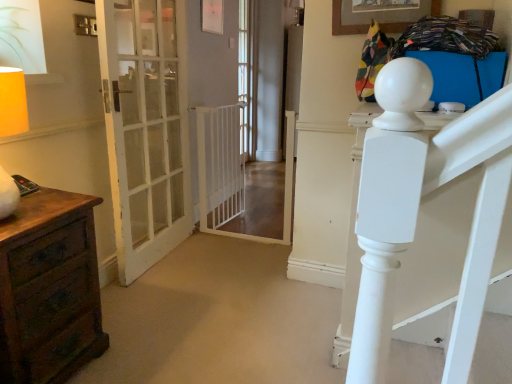
The width and height of the screenshot is (512, 384). What do you see at coordinates (344, 25) in the screenshot? I see `wooden picture frame at upper center` at bounding box center [344, 25].

In order to face white glass door at left, should I rotate leftwards or rightwards?

Turn left by 13.321 degrees to look at white glass door at left.

Find the location of a particular element. Image resolution: width=512 pixels, height=384 pixels. white glass door at left is located at coordinates (145, 127).

Image resolution: width=512 pixels, height=384 pixels. In order to click on wooden picture frame at upper center in this screenshot , I will do `click(344, 25)`.

Between brown wood chest of drawers at left and clear glass door at center, which one has larger size?

With larger size is brown wood chest of drawers at left.

From a real-world perspective, is brown wood chest of drawers at left physically located above or below clear glass door at center?

Clearly, from a real-world perspective, brown wood chest of drawers at left is below clear glass door at center.

Between point (78, 210) and point (256, 129), which one is positioned behind?

The point (256, 129) is more distant.

Would you consider brown wood chest of drawers at left to be distant from clear glass door at center?

Absolutely, brown wood chest of drawers at left is distant from clear glass door at center.

Between white glass door at left and white plastic gate at center, which one has more height?

Standing taller between the two is white glass door at left.

Which object is positioned more to the right, white glass door at left or white plastic gate at center?

white plastic gate at center is more to the right.

Based on the photo, is white glass door at left positioned with its back to white plastic gate at center?

No.

From a real-world perspective, is white glass door at left physically located above or below white plastic gate at center?

In terms of real-world spatial position, white glass door at left is above white plastic gate at center.

Does white glass door at left have a lesser height compared to wooden picture frame at upper center?

No.

At what (x,y) coordinates should I click in order to perform the action: click on door that is behind the wooden picture frame at upper center. Please return your answer as a coordinate pair (x, y). This screenshot has height=384, width=512. Looking at the image, I should click on (145, 127).

Is white glass door at left inside or outside of wooden picture frame at upper center?

white glass door at left is outside wooden picture frame at upper center.

Considering the positions of objects white glass door at left and wooden picture frame at upper center in the image provided, who is more to the left, white glass door at left or wooden picture frame at upper center?

From the viewer's perspective, white glass door at left appears more on the left side.

From a real-world perspective, is white plastic gate at center positioned above or below brown wood chest of drawers at left?

In terms of real-world spatial position, white plastic gate at center is above brown wood chest of drawers at left.

Would you consider white plastic gate at center to be distant from brown wood chest of drawers at left?

That's right, there is a large distance between white plastic gate at center and brown wood chest of drawers at left.

Does white plastic gate at center turn towards brown wood chest of drawers at left?

No, white plastic gate at center is not facing towards brown wood chest of drawers at left.

Is clear glass door at center positioned with its back to wooden picture frame at upper center?

That's not correct — clear glass door at center is not looking away from wooden picture frame at upper center.

Between point (248, 40) and point (439, 11), which one is positioned behind?

The point (248, 40) is farther from the camera.

I want to click on picture frame that appears in front of the clear glass door at center, so click(344, 25).

Does white plastic gate at center have a smaller size compared to wooden picture frame at upper center?

No.

Are white plastic gate at center and wooden picture frame at upper center located far from each other?

Absolutely, white plastic gate at center is distant from wooden picture frame at upper center.

Does white plastic gate at center turn towards wooden picture frame at upper center?

Yes, white plastic gate at center is aimed at wooden picture frame at upper center.

From a real-world perspective, is white plastic gate at center above or below wooden picture frame at upper center?

In terms of real-world spatial position, white plastic gate at center is below wooden picture frame at upper center.

Consider the image. From the image's perspective, between brown wood chest of drawers at left and white plastic gate at center, who is located below?

brown wood chest of drawers at left, from the image's perspective.

Is brown wood chest of drawers at left far from white plastic gate at center?

Indeed, brown wood chest of drawers at left is not near white plastic gate at center.

Which object is wider, brown wood chest of drawers at left or white plastic gate at center?

brown wood chest of drawers at left.

From a real-world perspective, which is physically below, brown wood chest of drawers at left or white plastic gate at center?

brown wood chest of drawers at left is physically lower.

Locate an element on the screen. The width and height of the screenshot is (512, 384). chest of drawers below the clear glass door at center (from the image's perspective) is located at coordinates (49, 288).

Identify the location of door on the left side of white plastic gate at center. (145, 127).

Based on their spatial positions, is brown wood chest of drawers at left or clear glass door at center further from white glass door at left?

The object further to white glass door at left is clear glass door at center.

Looking at the image, which one is located closer to clear glass door at center, brown wood chest of drawers at left or white glass door at left?

Among the two, white glass door at left is located nearer to clear glass door at center.

From the image, which object appears to be farther from white plastic gate at center, brown wood chest of drawers at left or clear glass door at center?

brown wood chest of drawers at left is positioned further to the anchor white plastic gate at center.

Looking at the image, which one is located further to brown wood chest of drawers at left, wooden picture frame at upper center or clear glass door at center?

clear glass door at center is positioned further to the anchor brown wood chest of drawers at left.

Based on their spatial positions, is white plastic gate at center or wooden picture frame at upper center further from white glass door at left?

Based on the image, wooden picture frame at upper center appears to be further to white glass door at left.

Based on their spatial positions, is wooden picture frame at upper center or white plastic gate at center further from brown wood chest of drawers at left?

white plastic gate at center is further to brown wood chest of drawers at left.

Looking at the image, which one is located further to brown wood chest of drawers at left, white glass door at left or white plastic gate at center?

Based on the image, white plastic gate at center appears to be further to brown wood chest of drawers at left.

Considering their positions, is clear glass door at center positioned closer to wooden picture frame at upper center than white glass door at left?

The object closer to wooden picture frame at upper center is white glass door at left.

You are a GUI agent. You are given a task and a screenshot of the screen. Output one action in this format:
    pyautogui.click(x=<x>, y=<y>)
    Task: Click on the radiator between white glass door at left and clear glass door at center along the z-axis
    
    Given the screenshot: What is the action you would take?
    [219, 165]

I want to click on radiator positioned between brown wood chest of drawers at left and clear glass door at center from near to far, so click(219, 165).

Where is `door between brown wood chest of drawers at left and wooden picture frame at upper center`? The image size is (512, 384). door between brown wood chest of drawers at left and wooden picture frame at upper center is located at coordinates (145, 127).

Image resolution: width=512 pixels, height=384 pixels. Find the location of `picture frame between brown wood chest of drawers at left and clear glass door at center from front to back`. picture frame between brown wood chest of drawers at left and clear glass door at center from front to back is located at coordinates (344, 25).